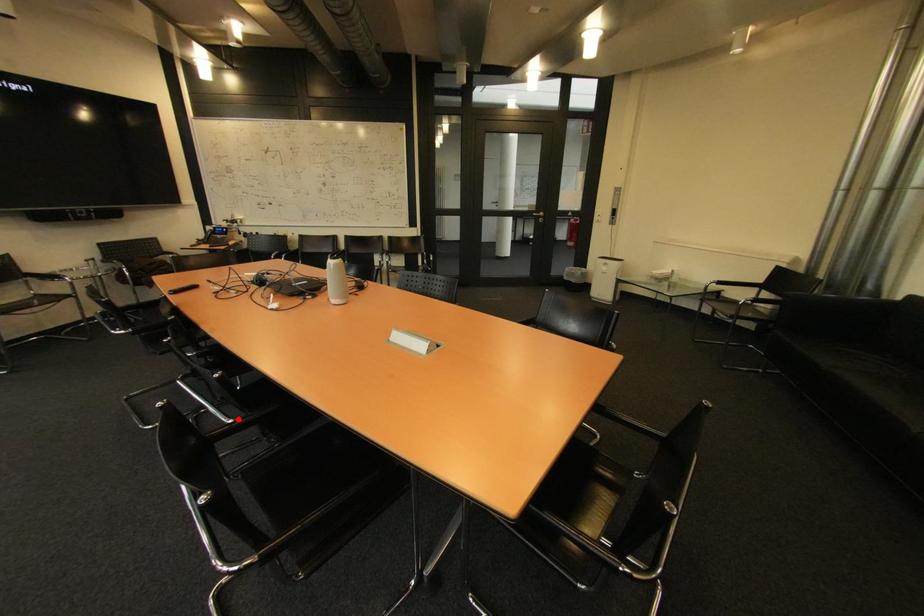
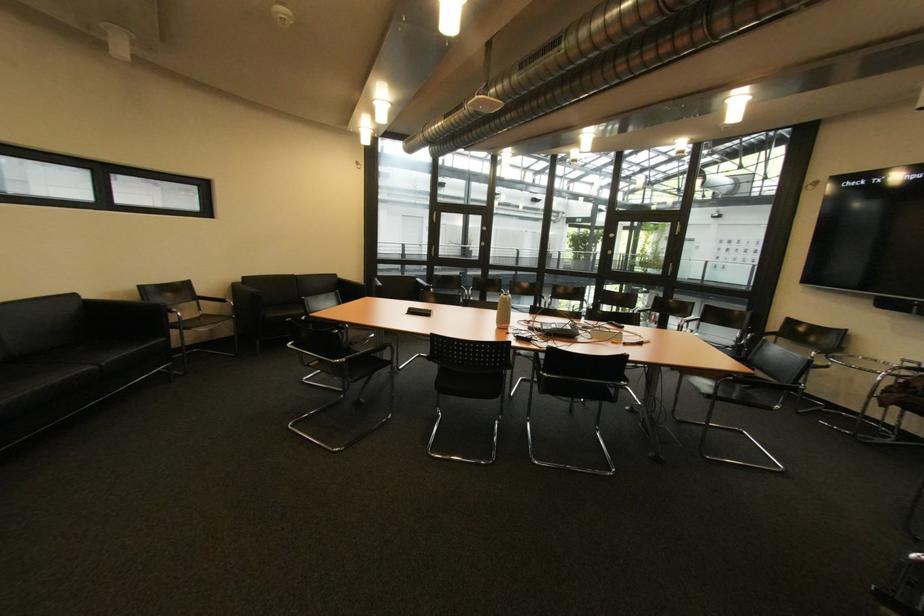
Question: I am providing you with two images of the same scene from different viewpoints. A red point is marked on the first image. Is the red point's position out of view in image 2?

Choices:
 (A) Yes
 (B) No

Answer: (A)